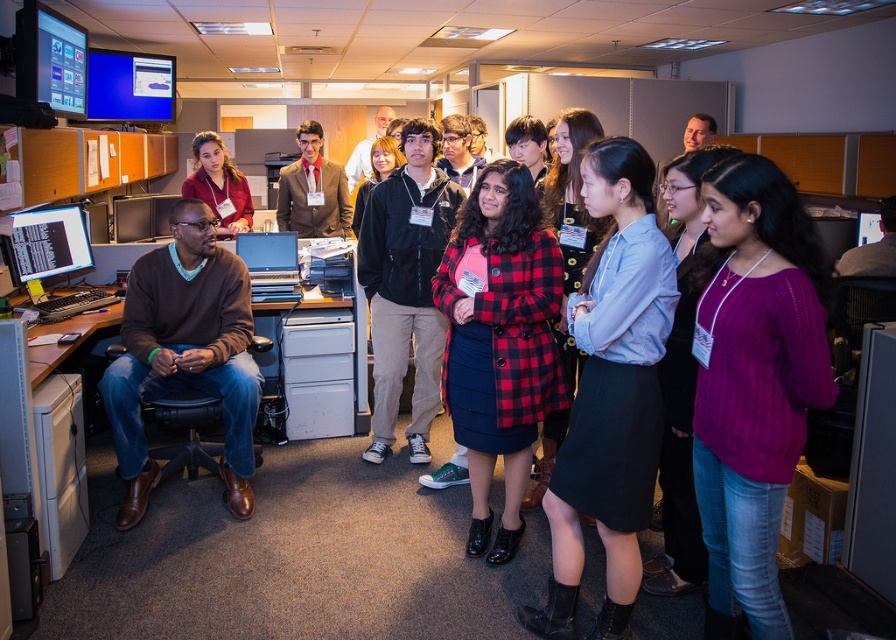
Can you confirm if light blue cotton shirt at center is bigger than matte black monitor at upper left?

A: Yes.

Who is taller, light blue cotton shirt at center or matte black monitor at upper left?

Standing taller between the two is light blue cotton shirt at center.

Which is in front, point (561, 602) or point (49, 19)?

Point (561, 602)

Find the location of a particular element. The image size is (896, 640). light blue cotton shirt at center is located at coordinates (610, 394).

Does knitted purple sweater at center appear under brown sweater at left?

Yes, knitted purple sweater at center is below brown sweater at left.

Between point (786, 342) and point (127, 400), which one is positioned behind?

The point (127, 400) is behind.

Identify the location of knitted purple sweater at center. This screenshot has height=640, width=896. (754, 381).

Which is behind, point (752, 440) or point (289, 173)?

The point (289, 173) is more distant.

Which is in front, point (703, 412) or point (306, 214)?

Point (703, 412) is in front.

Where is `knitted purple sweater at center`? This screenshot has width=896, height=640. knitted purple sweater at center is located at coordinates (754, 381).